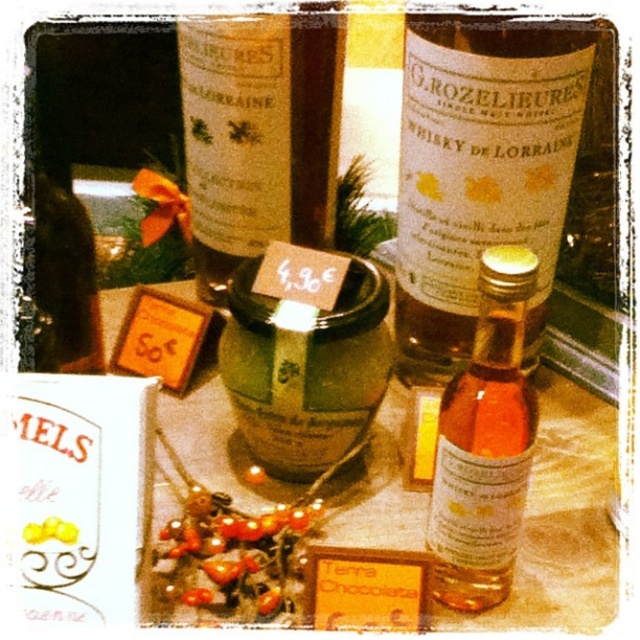
Question: Which is farther from the translucent amber glass bottle at center-right?

Choices:
 (A) matte glass bottle at center
 (B) matte glass whisky bottle at center

Answer: (A)

Question: Based on their relative distances, which object is nearer to the translucent glass jar at center?

Choices:
 (A) matte glass whisky bottle at center
 (B) matte glass bottle at center
 (C) translucent amber glass bottle at center-right

Answer: (C)

Question: Which of the following is the farthest from the observer?

Choices:
 (A) translucent amber glass bottle at center-right
 (B) matte glass whisky bottle at center
 (C) translucent glass jar at center
 (D) matte glass bottle at center

Answer: (D)

Question: Is translucent glass jar at center positioned behind matte glass bottle at center?

Choices:
 (A) yes
 (B) no

Answer: (B)

Question: Is matte glass whisky bottle at center below translucent amber glass bottle at center-right?

Choices:
 (A) yes
 (B) no

Answer: (B)

Question: In this image, where is translucent glass jar at center located relative to matte glass bottle at center?

Choices:
 (A) left
 (B) right

Answer: (B)